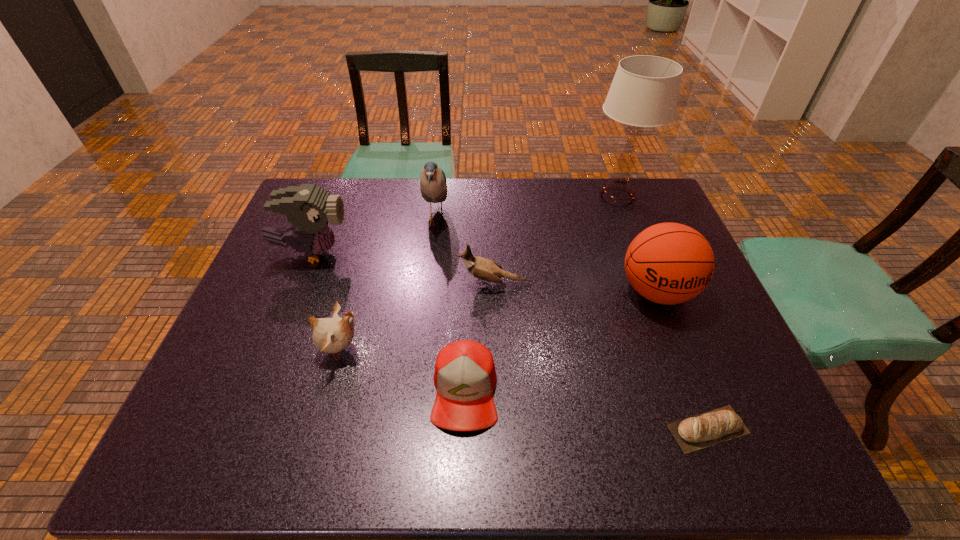
Locate an element on the screen. This screenshot has width=960, height=540. vacant position located on the front-facing side of the table lamp is located at coordinates (559, 198).

The image size is (960, 540). In order to click on free location located at the tip of the third bird from left to right's beak in this screenshot , I will do `click(566, 220)`.

You are a GUI agent. You are given a task and a screenshot of the screen. Output one action in this format:
    pyautogui.click(x=<x>, y=<y>)
    Task: Click on the vacant space located at the beak of the sixth nearest object
    The width and height of the screenshot is (960, 540).
    Given the screenshot: What is the action you would take?
    pyautogui.click(x=428, y=253)

Identify the location of vacant space situated 0.250m on the side with logo of the basketball. (705, 415).

Identify the location of free location located at the face of the rightmost bird. Image resolution: width=960 pixels, height=540 pixels. (372, 284).

The width and height of the screenshot is (960, 540). Identify the location of free spot located 0.100m at the face of the rightmost bird. (420, 284).

This screenshot has width=960, height=540. Find the location of `free point located 0.180m at the face of the rightmost bird`. free point located 0.180m at the face of the rightmost bird is located at coordinates (391, 284).

The width and height of the screenshot is (960, 540). Identify the location of vacant space located at the beak of the nearest bird. 387,349.

Image resolution: width=960 pixels, height=540 pixels. Find the location of `free space located on the front-facing side of the second shortest object`. free space located on the front-facing side of the second shortest object is located at coordinates (463, 460).

Identify the location of free space located on the back of the pita bread. This screenshot has height=540, width=960. (662, 312).